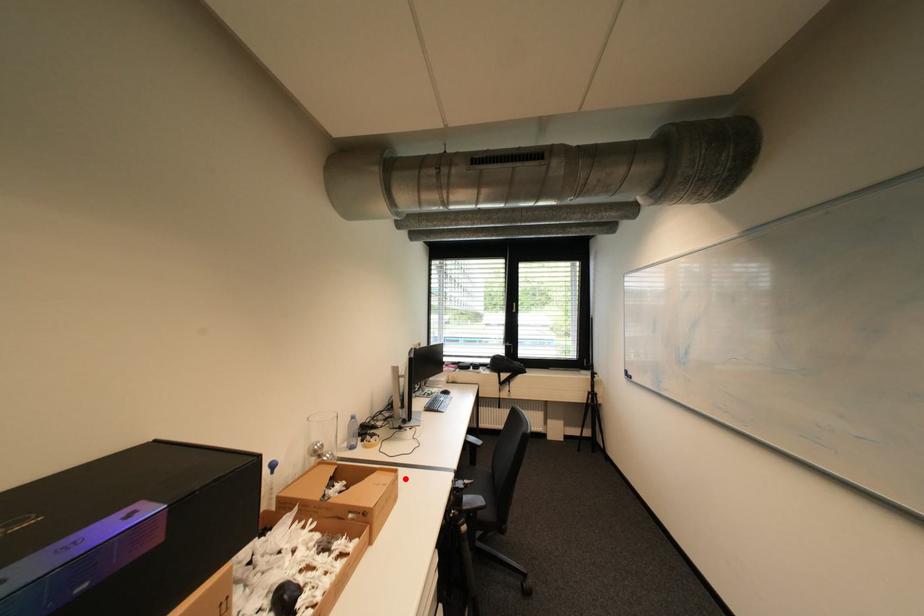
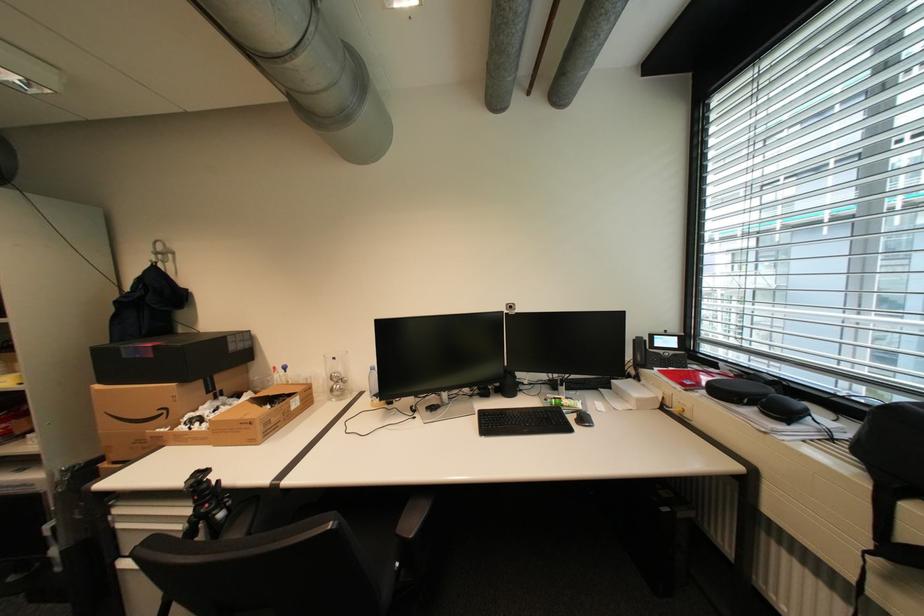
Where in the second image is the point corresponding to the highlighted location from the first image?

(259, 424)